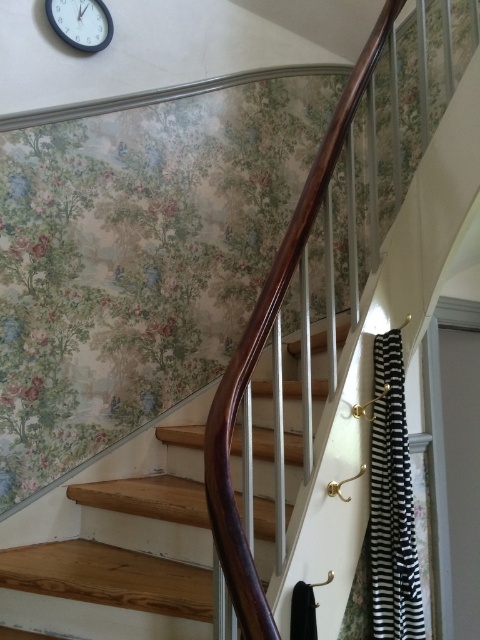
Question: Is wooden stairs at center above blue glossy clock at upper left?

Choices:
 (A) yes
 (B) no

Answer: (B)

Question: Which point is closer to the camera?

Choices:
 (A) blue glossy clock at upper left
 (B) wooden stairs at center

Answer: (B)

Question: Does wooden stairs at center have a smaller size compared to blue glossy clock at upper left?

Choices:
 (A) yes
 (B) no

Answer: (B)

Question: Can you confirm if wooden stairs at center is positioned to the left of blue glossy clock at upper left?

Choices:
 (A) yes
 (B) no

Answer: (B)

Question: Which point is farther from the camera taking this photo?

Choices:
 (A) (85, 35)
 (B) (98, 602)

Answer: (A)

Question: Which point is farther to the camera?

Choices:
 (A) blue glossy clock at upper left
 (B) wooden stairs at center

Answer: (A)